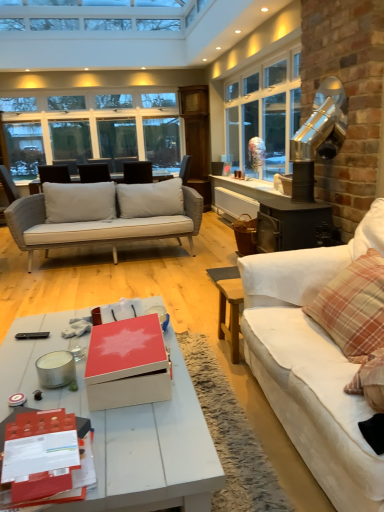
Find the location of `vacant space in front of matte red box at center`. vacant space in front of matte red box at center is located at coordinates (143, 435).